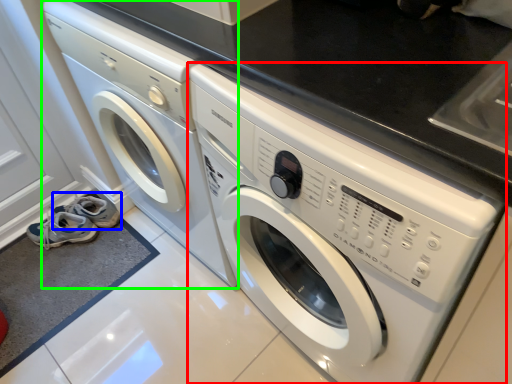
Question: Based on their relative distances, which object is nearer to washing machine (highlighted by a red box)? Choose from shoe (highlighted by a blue box) and washing machine (highlighted by a green box).

Choices:
 (A) shoe
 (B) washing machine

Answer: (B)